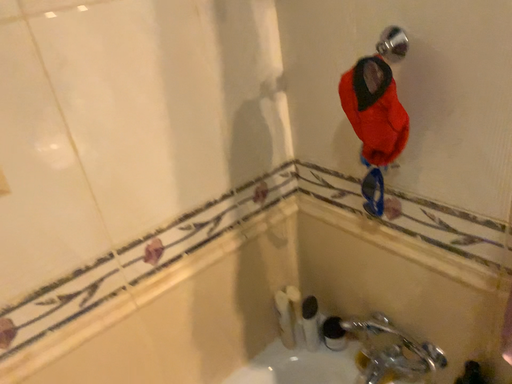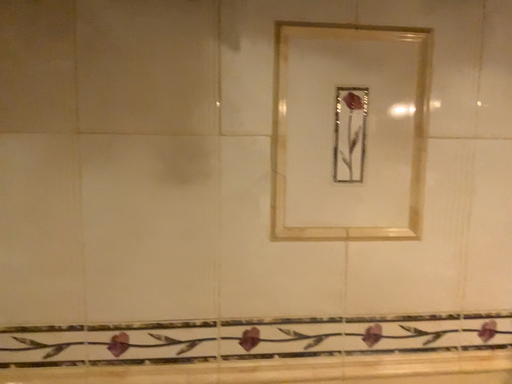
Question: Which way did the camera rotate in the video?

Choices:
 (A) rotated upward
 (B) rotated downward

Answer: (A)